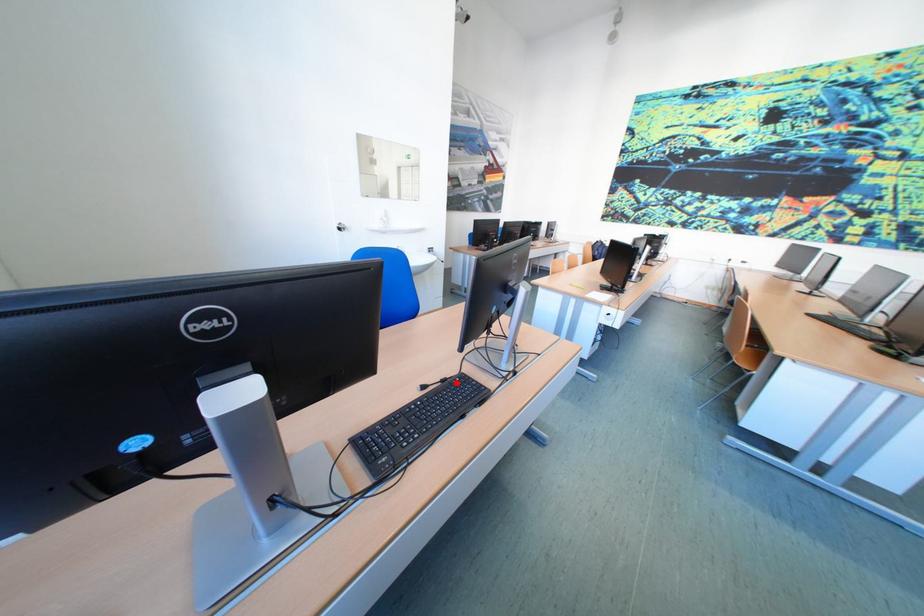
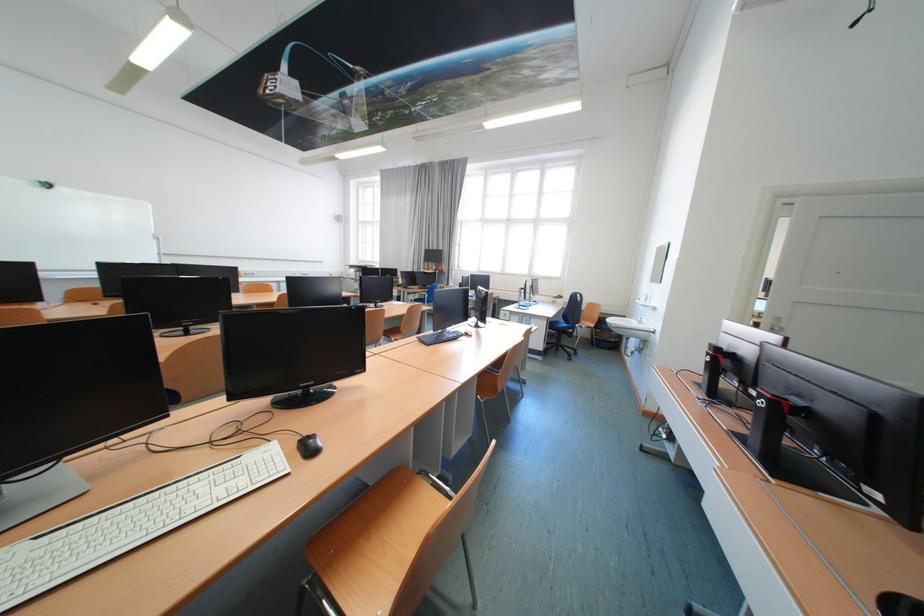
Question: I am providing you with two images of the same scene from different viewpoints. A red point is marked on the first image. Is the red point's position out of view in image 2?

Choices:
 (A) Yes
 (B) No

Answer: (A)